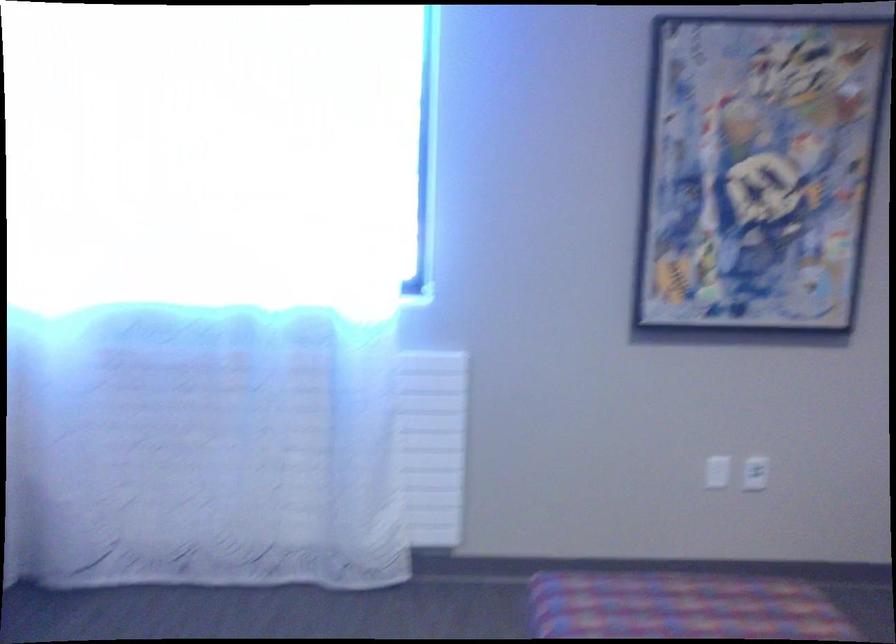
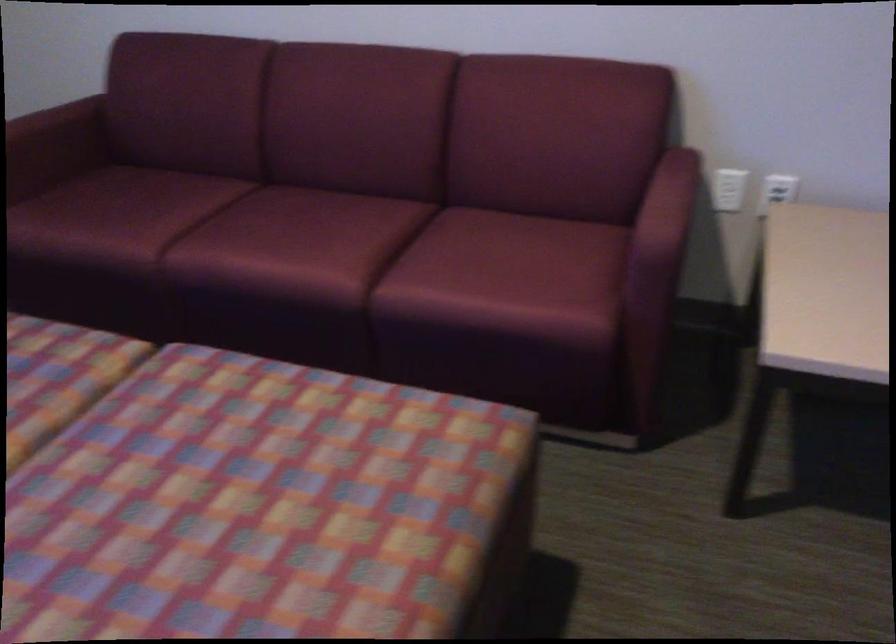
The first image is from the beginning of the video and the second image is from the end. How did the camera likely rotate when shooting the video?

The camera's rotation is toward right-down.